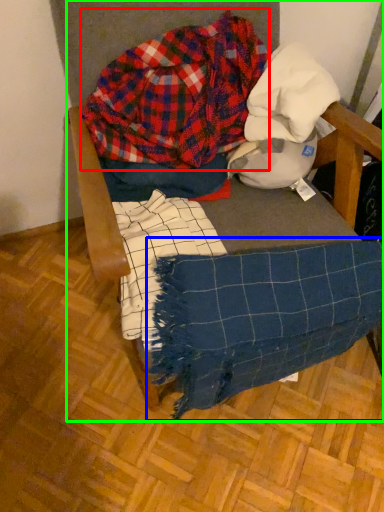
Question: Considering the real-world distances, which object is farthest from flannel (highlighted by a red box)? blanket (highlighted by a blue box) or furniture (highlighted by a green box)?

Choices:
 (A) blanket
 (B) furniture

Answer: (A)